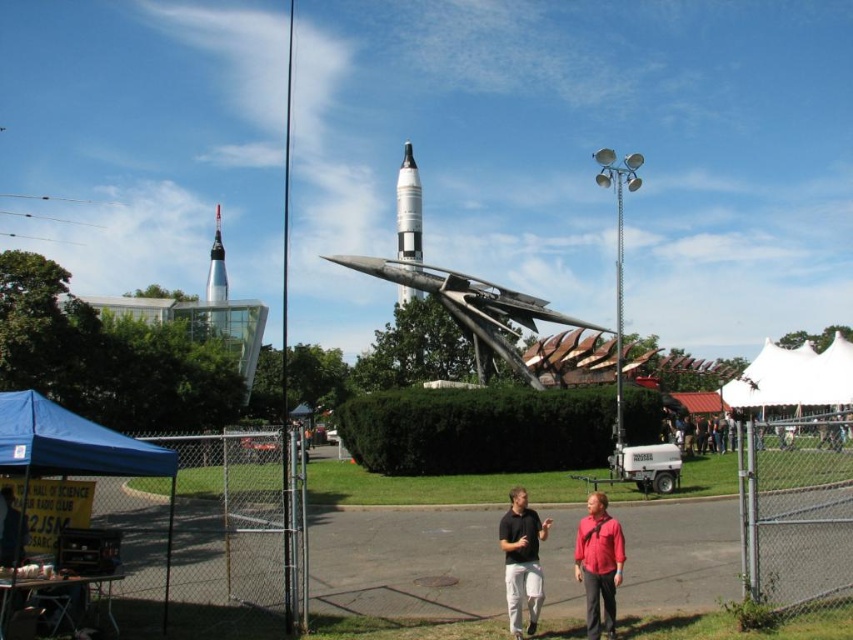
Between silver chain-link fence at lower right and blue fabric tent at lower left, which one has less height?

With less height is silver chain-link fence at lower right.

Does silver chain-link fence at lower right appear on the right side of blue fabric tent at lower left?

Indeed, silver chain-link fence at lower right is positioned on the right side of blue fabric tent at lower left.

Find the location of `silver chain-link fence at lower right`. silver chain-link fence at lower right is located at coordinates (796, 509).

Is silver chain-link fence at left to the left of silver chain-link fence at lower right from the viewer's perspective?

Correct, you'll find silver chain-link fence at left to the left of silver chain-link fence at lower right.

Who is more distant from viewer, (294, 628) or (782, 522)?

The point (782, 522) is more distant.

At what (x,y) coordinates should I click in order to perform the action: click on silver chain-link fence at left. Please return your answer as a coordinate pair (x, y). This screenshot has height=640, width=853. Looking at the image, I should click on (224, 522).

Who is more distant from viewer, [519,563] or [407,188]?

Positioned behind is point [407,188].

Who is positioned more to the left, matte black shirt at center or shiny silver rocket at center?

shiny silver rocket at center

Which is in front, point (527, 600) or point (416, 182)?

Point (527, 600) is in front.

The height and width of the screenshot is (640, 853). Find the location of `matte black shirt at center`. matte black shirt at center is located at coordinates [521, 561].